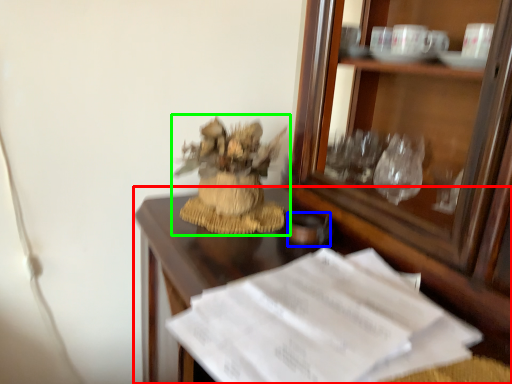
Question: Which is farther away from desk (highlighted by a red box)? tableware (highlighted by a blue box) or houseplant (highlighted by a green box)?

Choices:
 (A) tableware
 (B) houseplant

Answer: (A)